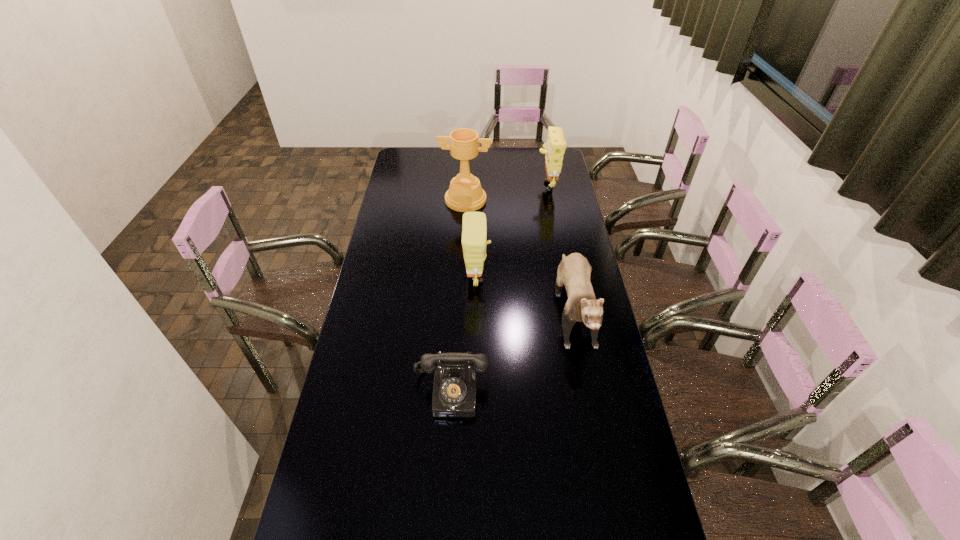
You are a GUI agent. You are given a task and a screenshot of the screen. Output one action in this format:
    pyautogui.click(x=<x>, y=<y>)
    Task: Click on the award
    
    Given the screenshot: What is the action you would take?
    pyautogui.click(x=465, y=194)

Where is `the right sponge`? The image size is (960, 540). the right sponge is located at coordinates (554, 149).

Identify the location of the left sponge. This screenshot has width=960, height=540. (474, 227).

The width and height of the screenshot is (960, 540). Find the location of `ferret`. ferret is located at coordinates (574, 271).

What are the coordinates of `the shortest object` in the screenshot? It's located at (454, 389).

Find the location of a particular element. The width and height of the screenshot is (960, 540). free space located 0.140m on the front of the tallest object is located at coordinates (465, 232).

At what (x,y) coordinates should I click in order to perform the action: click on vacant space located 0.320m on the face of the farther sponge. Please return your answer as a coordinate pair (x, y). Looking at the image, I should click on (470, 184).

You are a GUI agent. You are given a task and a screenshot of the screen. Output one action in this format:
    pyautogui.click(x=<x>, y=<y>)
    Task: Click on the vacant region located on the face of the farther sponge
    Image resolution: width=960 pixels, height=540 pixels.
    Given the screenshot: What is the action you would take?
    pyautogui.click(x=462, y=184)

Find the location of a particular element. The height and width of the screenshot is (540, 960). free location located on the face of the farther sponge is located at coordinates (465, 184).

Where is `free region located on the face of the nearer sponge`? This screenshot has width=960, height=540. free region located on the face of the nearer sponge is located at coordinates (583, 277).